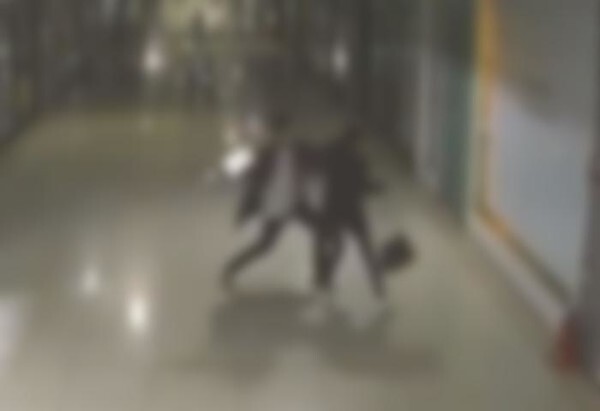
Identify the location of yellow line on wall. Image resolution: width=600 pixels, height=411 pixels. (489, 31).